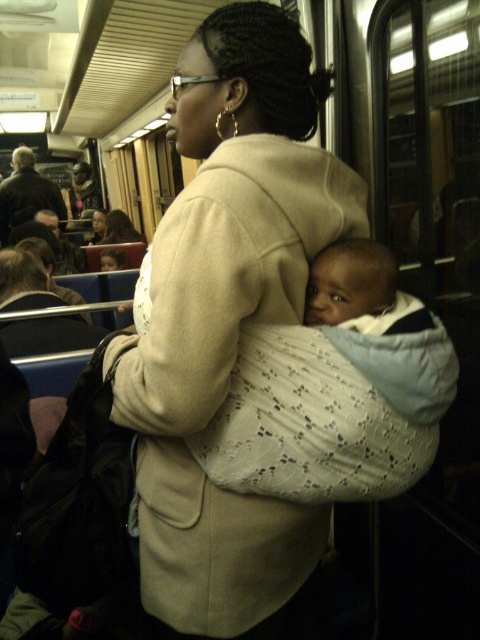
Question: Which of these objects is positioned closest to the matte black backpack at upper left?

Choices:
 (A) matte beige coat at center
 (B) beige fabric baby carrier at center

Answer: (A)

Question: Does beige fabric baby carrier at center appear on the right side of matte black backpack at upper left?

Choices:
 (A) yes
 (B) no

Answer: (A)

Question: Does matte black backpack at upper left appear on the left side of matte beige coat at center?

Choices:
 (A) no
 (B) yes

Answer: (B)

Question: Which point is farther to the camera?

Choices:
 (A) (275, 618)
 (B) (127, 225)

Answer: (B)

Question: Which point appears closest to the camera in this image?

Choices:
 (A) (33, 202)
 (B) (112, 237)

Answer: (A)

Question: Is beige fabric baby carrier at center positioned before matte black backpack at upper left?

Choices:
 (A) yes
 (B) no

Answer: (A)